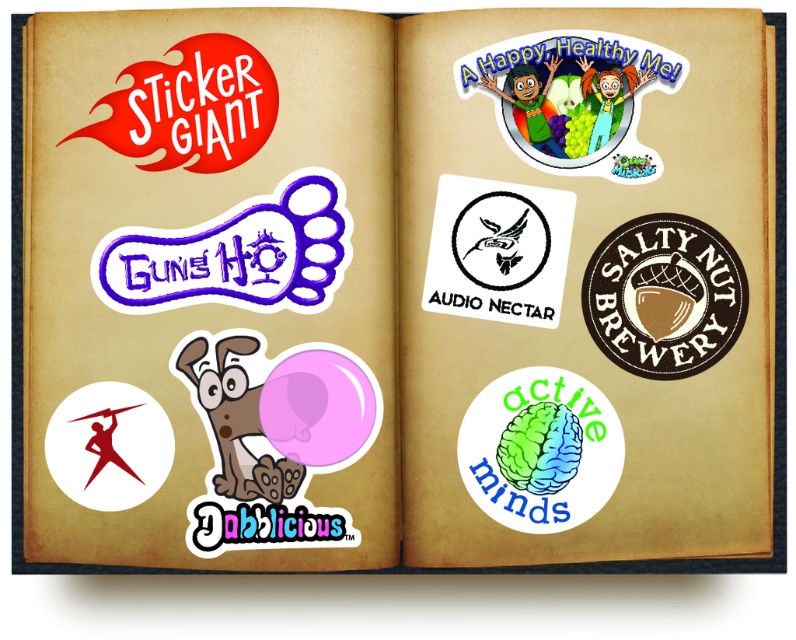
Consider the image. You are a stamp collector who wants to place a new stamp between the brown textured patch at upper right and the red rubber stamp at upper left. The stamp you have is 2 inches wide. Is there enough space between them to fit your stamp?

The brown textured patch at upper right and red rubber stamp at upper left are 16.64 inches apart from each other, so yes, there is enough space to fit a 2 inch wide stamp between them.

Looking at the open book with vintage paper texture, you notice the rainbow matte brain at center and the white matte sticker at center. Which object is taller?

The rainbow matte brain at center is much taller than the white matte sticker at center.